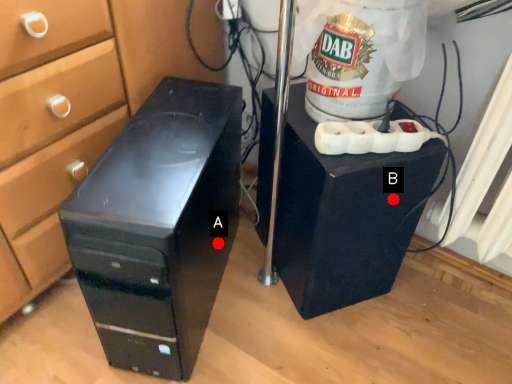
Question: Two points are circled on the image, labeled by A and B beside each circle. Which point is closer to the camera taking this photo?

Choices:
 (A) A is closer
 (B) B is closer

Answer: (B)